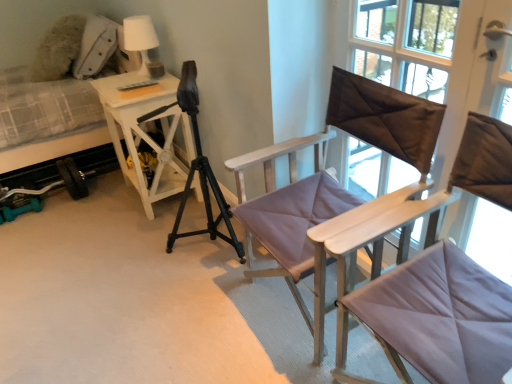
Where is `blank space situated above white wood side table at left (from a real-world perspective)`? blank space situated above white wood side table at left (from a real-world perspective) is located at coordinates 132,84.